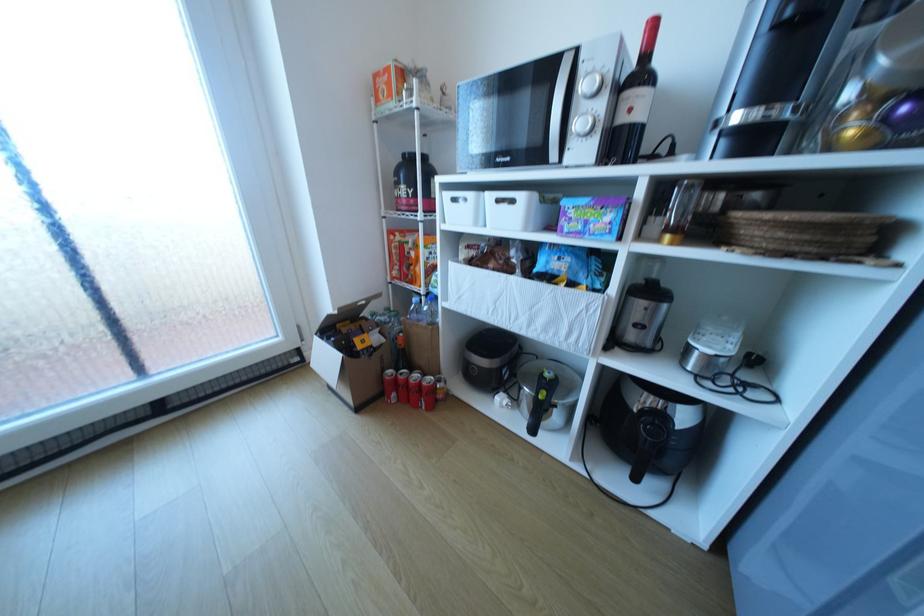
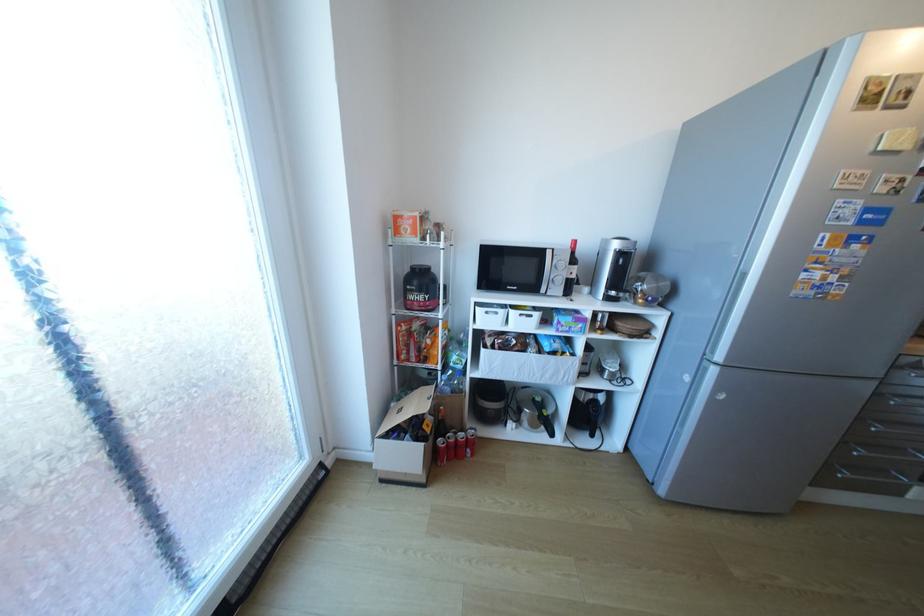
Find the pixel in the second image that matches (336,339) in the first image.

(407, 437)